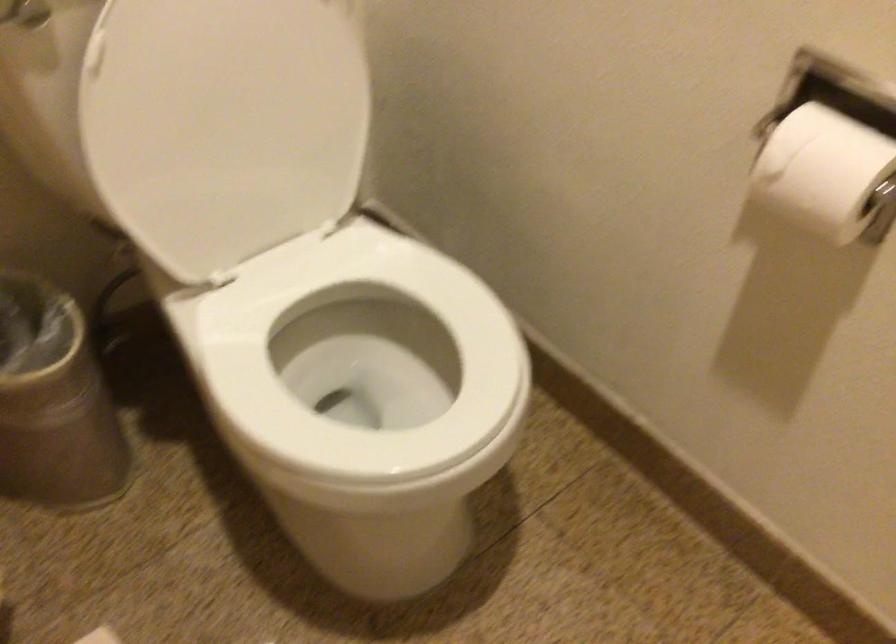
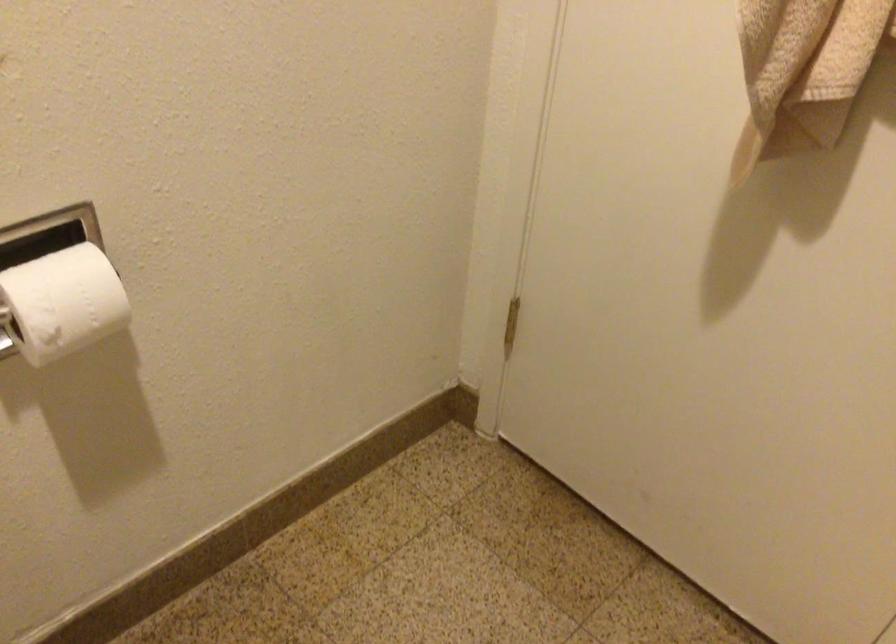
Where in the second image is the point corresponding to (x=789, y=155) from the first image?

(62, 303)